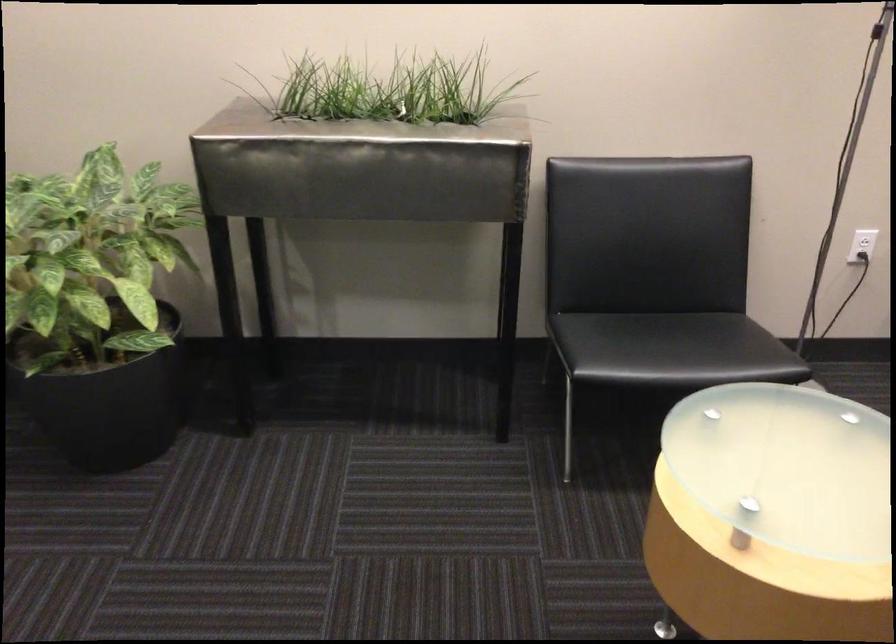
Identify the location of black chair sitting surface. (672, 348).